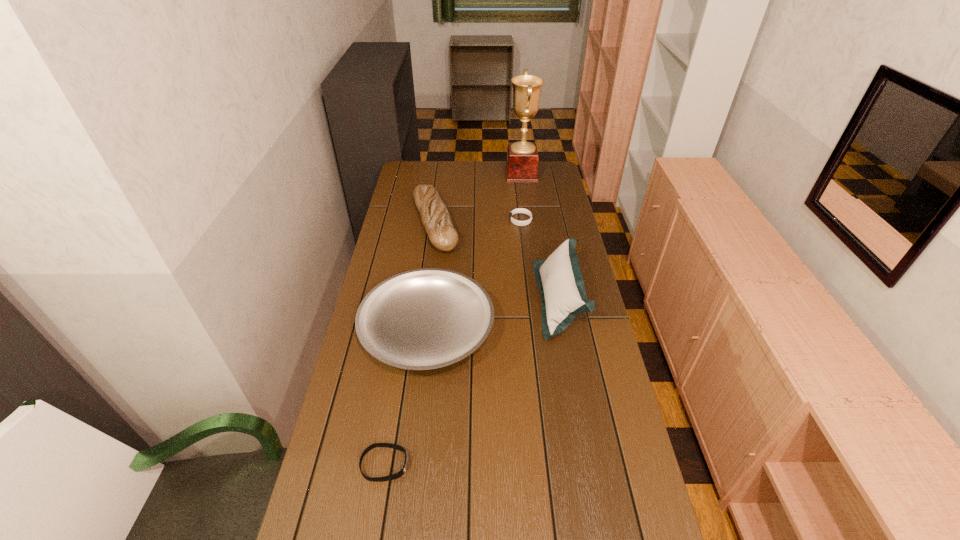
Locate an element on the screen. The width and height of the screenshot is (960, 540). free space located on the display of the shorter wristband is located at coordinates (553, 464).

Find the location of `object that is positioned at the far edge`. object that is positioned at the far edge is located at coordinates (522, 157).

Where is `baguet positioned at the left edge`? Image resolution: width=960 pixels, height=540 pixels. baguet positioned at the left edge is located at coordinates (435, 217).

The image size is (960, 540). In order to click on bedpan that is positioned at the left edge in this screenshot , I will do `click(422, 319)`.

Where is `wristband that is at the left edge`? The height and width of the screenshot is (540, 960). wristband that is at the left edge is located at coordinates (397, 475).

The width and height of the screenshot is (960, 540). Identify the location of trophy cup situated at the right edge. (522, 157).

The image size is (960, 540). Find the location of `cushion at the right edge`. cushion at the right edge is located at coordinates (559, 278).

Image resolution: width=960 pixels, height=540 pixels. I want to click on object that is positioned at the far right corner, so click(x=522, y=157).

In the image, there is a desktop. Where is `vacant area at the far edge`? Image resolution: width=960 pixels, height=540 pixels. vacant area at the far edge is located at coordinates (442, 177).

In the image, there is a desktop. Where is `vacant space at the left edge`? The width and height of the screenshot is (960, 540). vacant space at the left edge is located at coordinates (381, 265).